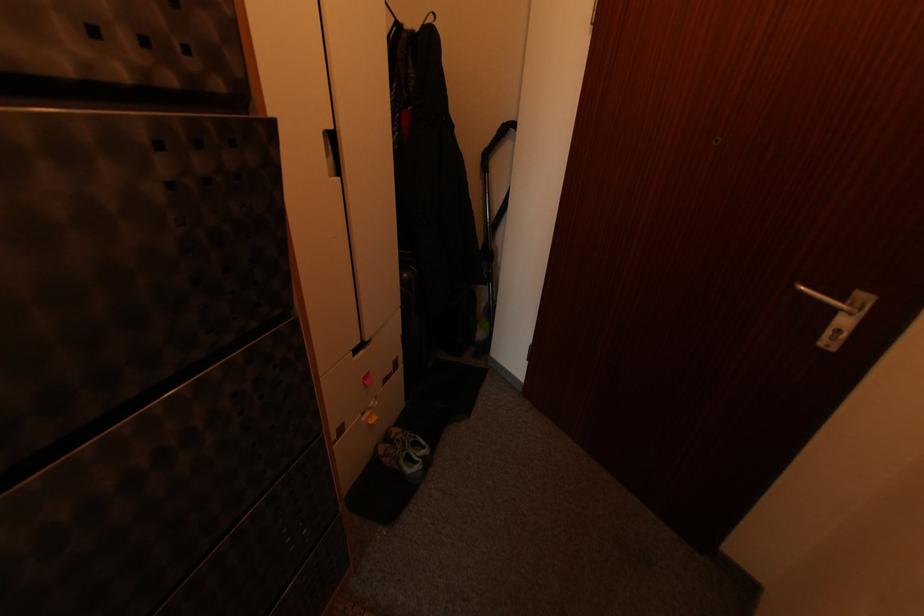
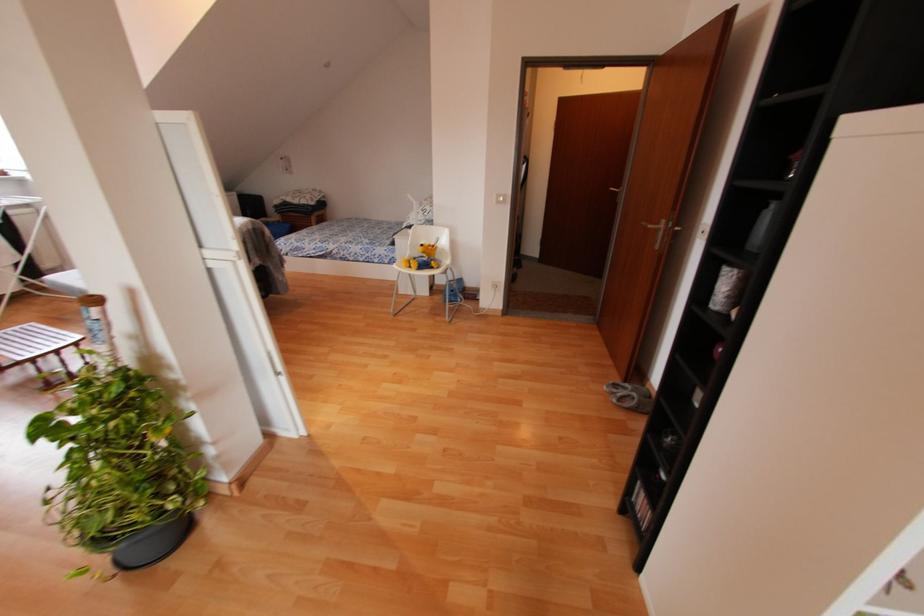
What movement of the cameraman would produce the second image?

The cameraman moved toward left, backward.